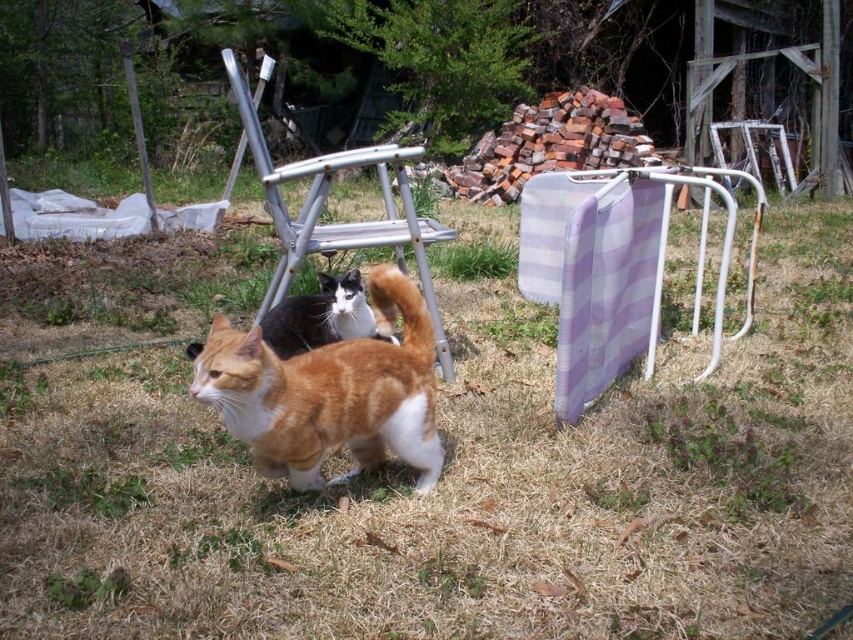
You are trying to determine if the brown dry grass at center can fully cover the orange tabby cat at center. Based on their sizes, what do you think?

The brown dry grass at center might be wider than orange tabby cat at center, so it could potentially cover the cat if positioned correctly.

You are a photographer trying to capture a clear shot of the orange and white fur cat at center without the brown dry grass at center blocking the view. How should you adjust your camera position?

Move the camera lower to position it below the brown dry grass at center so it won not block the view of the orange and white fur cat at center.

You are standing in the backyard and want to pick up two items located at point (583, 577) and point (300, 314). Which point is closer to you?

Point (583, 577) is closer to the camera than point (300, 314), so you should pick up the item at point (583, 577) first as it is nearer to you.